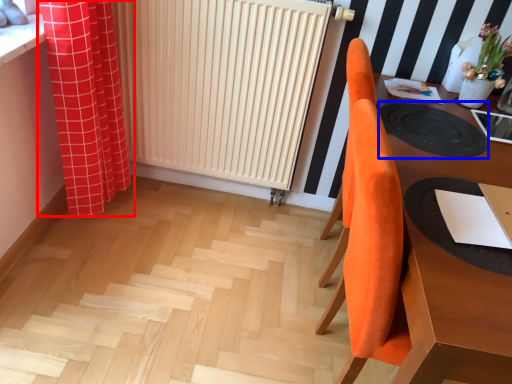
Question: Which object appears farthest to the camera in this image, curtain (highlighted by a red box) or mat (highlighted by a blue box)?

Choices:
 (A) curtain
 (B) mat

Answer: (A)